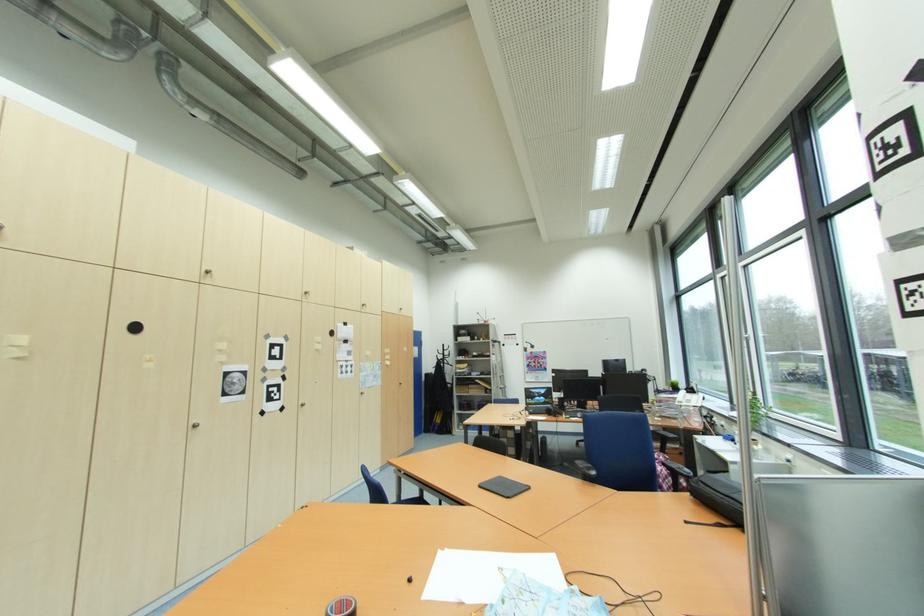
The location [342,607] corresponds to which object?

It refers to a red tape roll.